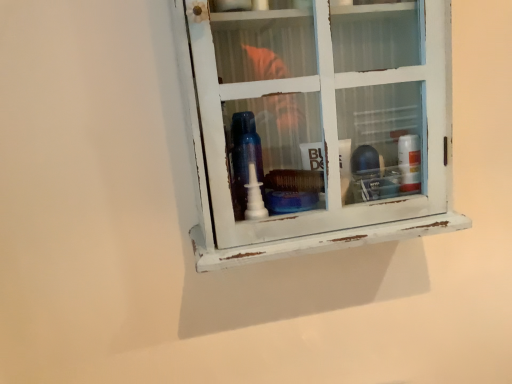
Where is `white distressed wood cabinet at center`? Image resolution: width=512 pixels, height=384 pixels. white distressed wood cabinet at center is located at coordinates (320, 123).

Describe the element at coordinates (320, 123) in the screenshot. Image resolution: width=512 pixels, height=384 pixels. I see `white distressed wood cabinet at center` at that location.

This screenshot has width=512, height=384. I want to click on white distressed wood cabinet at center, so click(x=320, y=123).